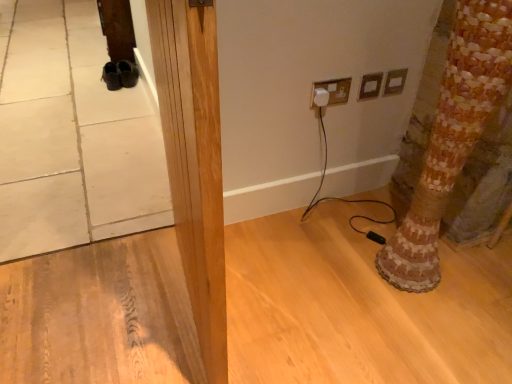
I want to click on vacant space behind wooden mosaic tree trunk at lower right, so click(371, 226).